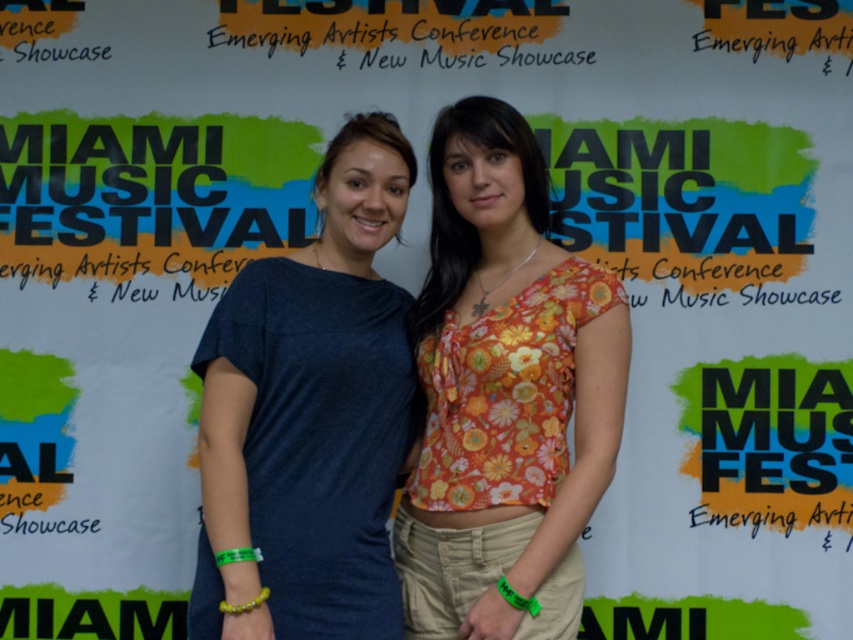
Question: Is floral fabric top at center positioned before matte blue t-shirt at center?

Choices:
 (A) yes
 (B) no

Answer: (B)

Question: Which point appears closest to the camera in this image?

Choices:
 (A) (201, 596)
 (B) (515, 116)

Answer: (A)

Question: Considering the relative positions of floral fabric top at center and matte blue t-shirt at center in the image provided, where is floral fabric top at center located with respect to matte blue t-shirt at center?

Choices:
 (A) below
 (B) above

Answer: (B)

Question: Which of the following is the closest to the observer?

Choices:
 (A) (219, 435)
 (B) (579, 579)

Answer: (A)

Question: Observing the image, what is the correct spatial positioning of floral fabric top at center in reference to matte blue t-shirt at center?

Choices:
 (A) left
 (B) right

Answer: (B)